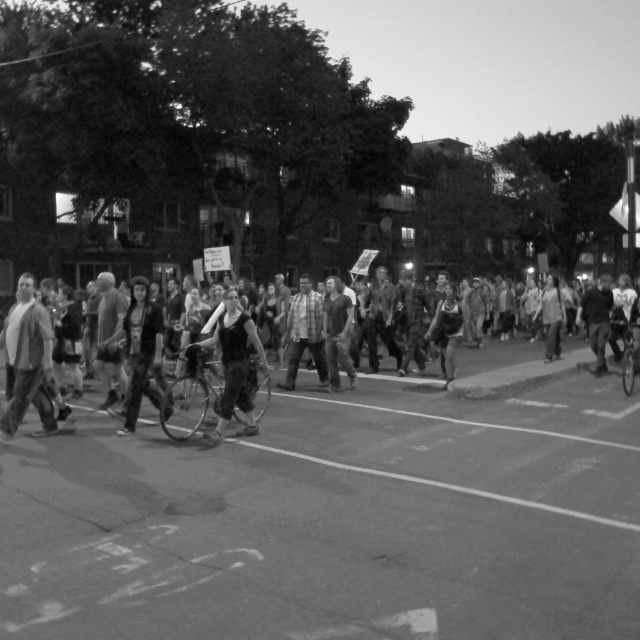
You are a photographer at the protest scene. You want to take a photo that includes both the denim pants at center and the black fabric dress at center. Which of the two should you focus on to ensure the subject appears larger in the photo?

The denim pants at center is taller than the black fabric dress at center, so focusing on the denim pants at center will make it appear larger in the photo.

From the picture: What is located at the coordinates point [422,412]?

Denim pants at center is located at point [422,412].